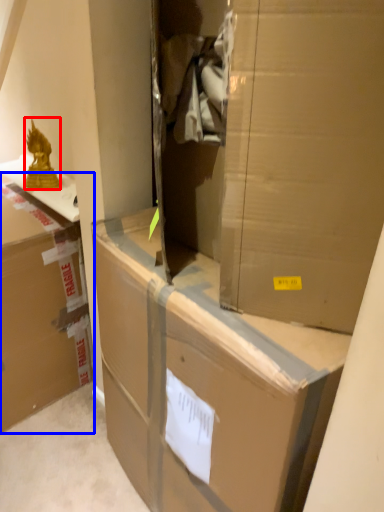
Question: Which of the following is the farthest to the observer, wrap (highlighted by a red box) or box (highlighted by a blue box)?

Choices:
 (A) wrap
 (B) box

Answer: (A)